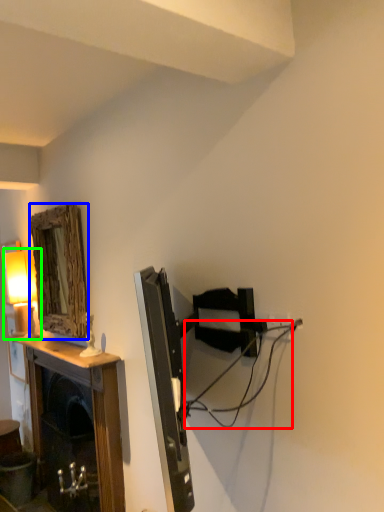
Question: Which object is the farthest from cable (highlighted by a red box)? Choose among these: mirror (highlighted by a blue box) or table lamp (highlighted by a green box).

Choices:
 (A) mirror
 (B) table lamp

Answer: (B)